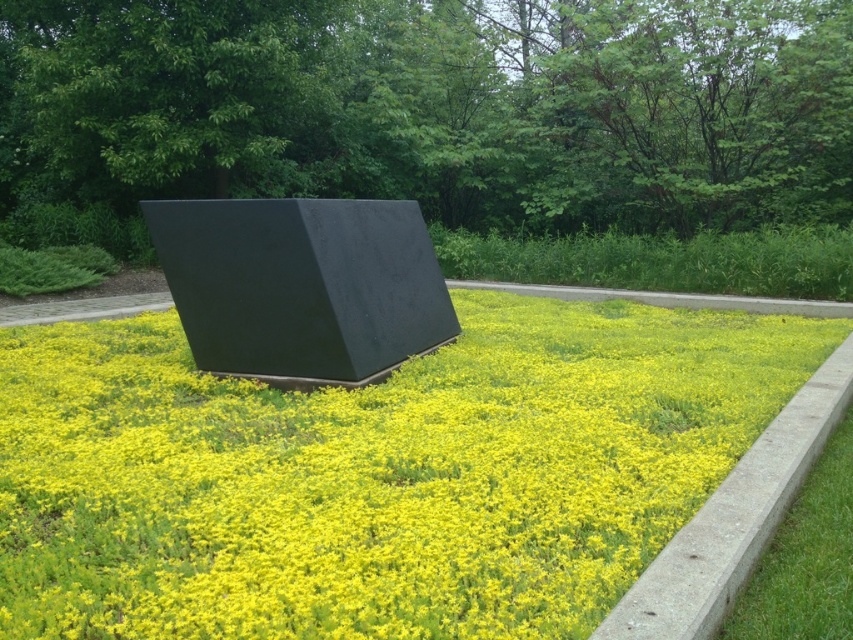
Is yellow matte flower at center closer to camera compared to concrete at center?

No.

Looking at this image, how distant is yellow matte flower at center from concrete at center?

1.79 meters

Who is more forward, (642, 448) or (817, 404)?

Point (642, 448) is in front.

Where is `yellow matte flower at center`? This screenshot has width=853, height=640. yellow matte flower at center is located at coordinates (373, 474).

Which of these two, yellow matte flower at center or green grass at lower right, stands taller?

green grass at lower right

Is yellow matte flower at center to the right of green grass at lower right from the viewer's perspective?

In fact, yellow matte flower at center is to the left of green grass at lower right.

Is point (271, 616) positioned after point (781, 586)?

No, (271, 616) is closer to viewer.

The image size is (853, 640). In order to click on yellow matte flower at center in this screenshot , I will do `click(373, 474)`.

Does concrete at center appear under green grass at lower right?

No.

Identify the location of concrete at center. (734, 518).

Find the location of a particular element. The image size is (853, 640). concrete at center is located at coordinates (734, 518).